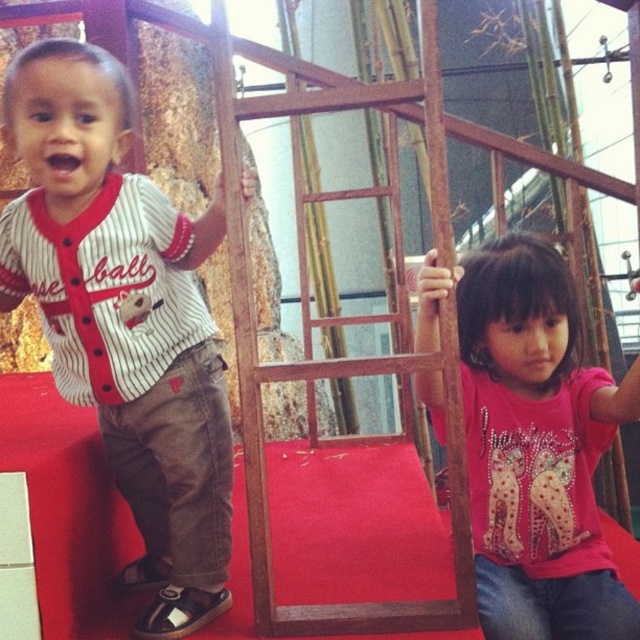
Question: Which point is farther to the camera?

Choices:
 (A) white striped jersey at left
 (B) pink glittery shirt at center

Answer: (B)

Question: Is white striped jersey at left thinner than pink glittery shirt at center?

Choices:
 (A) yes
 (B) no

Answer: (B)

Question: Can you confirm if white striped jersey at left is smaller than pink glittery shirt at center?

Choices:
 (A) yes
 (B) no

Answer: (B)

Question: From the image, what is the correct spatial relationship of white striped jersey at left in relation to pink glittery shirt at center?

Choices:
 (A) below
 (B) above

Answer: (B)

Question: Among these points, which one is nearest to the camera?

Choices:
 (A) (61, 170)
 (B) (515, 548)

Answer: (A)

Question: Which point appears farthest from the camera in this image?

Choices:
 (A) (134, 584)
 (B) (440, 422)

Answer: (A)